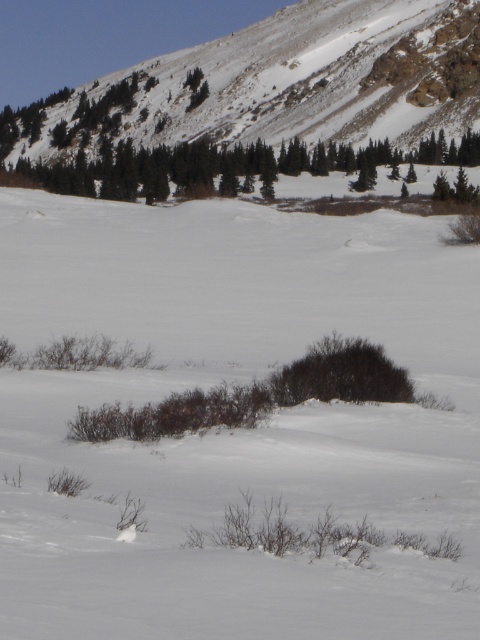
Which of these two, white fluffy snow at center or snowy rock at upper center, stands shorter?

white fluffy snow at center is shorter.

Where is `white fluffy snow at center`? white fluffy snow at center is located at coordinates (235, 429).